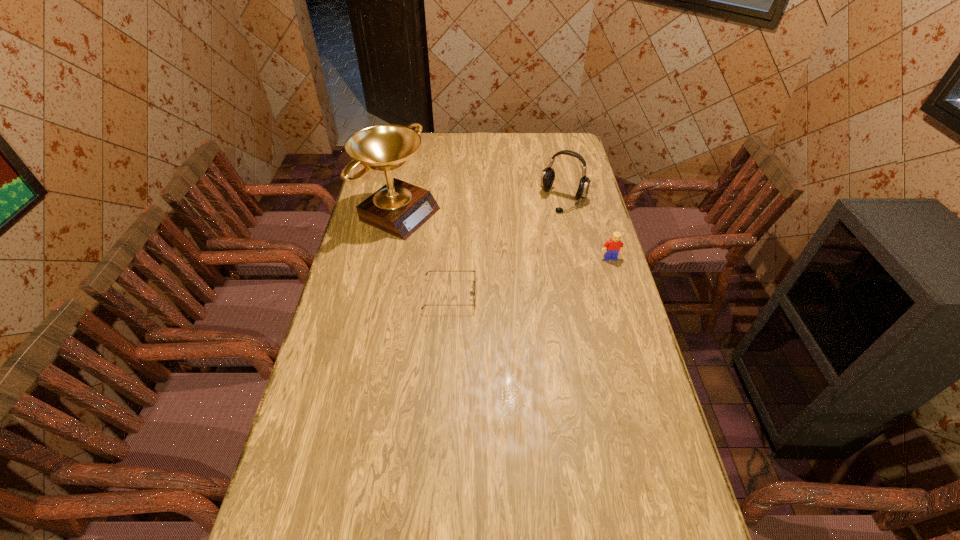
Find the location of `free space between the sunglasses and the third farthest object`. free space between the sunglasses and the third farthest object is located at coordinates (530, 276).

Locate an element on the screen. The width and height of the screenshot is (960, 540). free space that is in between the shortest object and the award is located at coordinates (425, 253).

This screenshot has height=540, width=960. I want to click on empty space between the shortest object and the tallest object, so click(x=425, y=253).

Select which object is the closest to the headset. Please provide its 2D coordinates. Your answer should be formatted as a tuple, i.e. [(x, y)], where the tuple contains the x and y coordinates of a point satisfying the conditions above.

[(614, 245)]

Locate an element on the screen. object that is the second nearest to the third shortest object is located at coordinates (399, 208).

Locate an element on the screen. vacant position in the image that satisfies the following two spatial constraints: 1. on the back side of the award; 2. on the right side of the second tallest object is located at coordinates (403, 200).